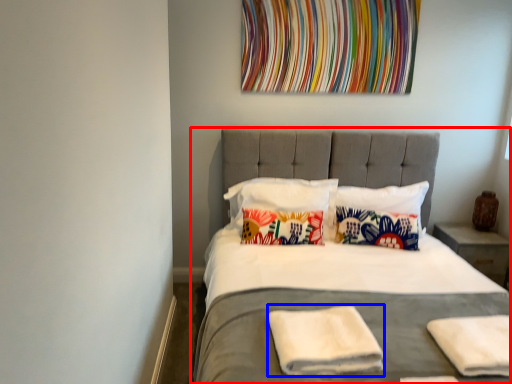
Question: Which object is further to the camera taking this photo, bed (highlighted by a red box) or material (highlighted by a blue box)?

Choices:
 (A) bed
 (B) material

Answer: (B)